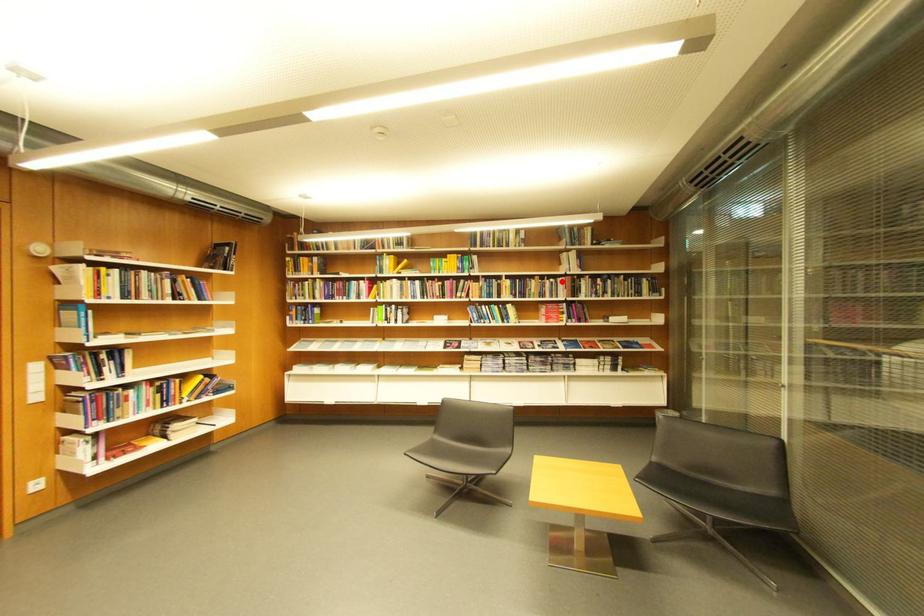
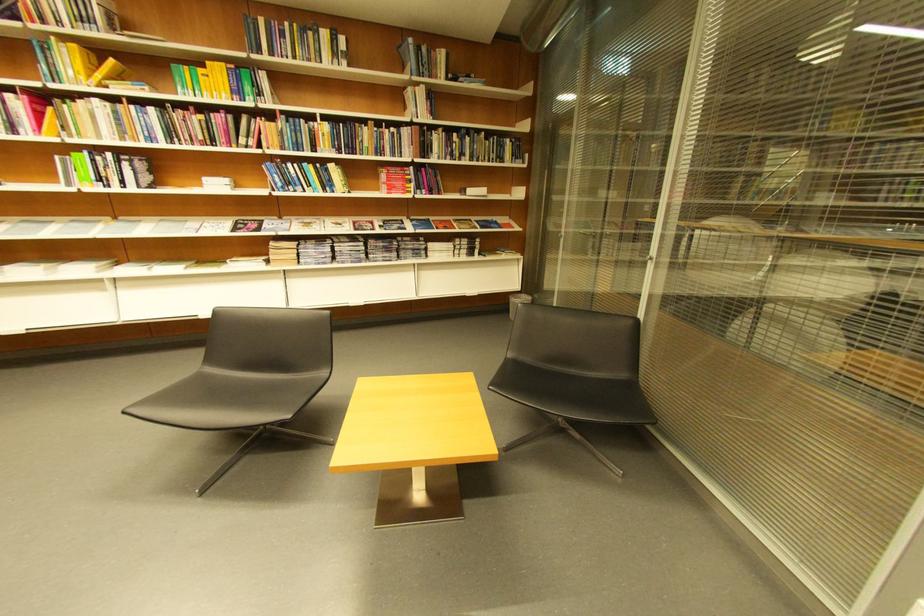
Find the pixel in the second image that matches the highlighted location in the first image.

(403, 131)